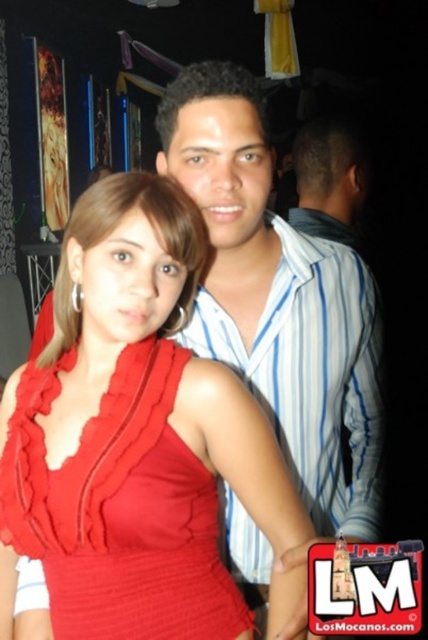
Between striped cotton shirt at upper center and matte blue shirt at center, which one is positioned higher?

Positioned higher is matte blue shirt at center.

Between striped cotton shirt at upper center and matte blue shirt at center, which one appears on the left side from the viewer's perspective?

Positioned to the left is striped cotton shirt at upper center.

Is point (359, 416) less distant than point (350, 243)?

Yes.

The height and width of the screenshot is (640, 428). Identify the location of striped cotton shirt at upper center. (312, 372).

Which is in front, point (190, 628) or point (365, 150)?

Positioned in front is point (190, 628).

Identify the location of red satin dress at center. This screenshot has width=428, height=640. (119, 509).

Who is higher up, red satin dress at center or striped cotton shirt at upper center?

striped cotton shirt at upper center

From the picture: Is red satin dress at center bigger than striped cotton shirt at upper center?

No.

Who is more distant from viewer, (x=55, y=488) or (x=297, y=269)?

The point (x=297, y=269) is more distant.

Locate an element on the screen. The image size is (428, 640). red satin dress at center is located at coordinates (119, 509).